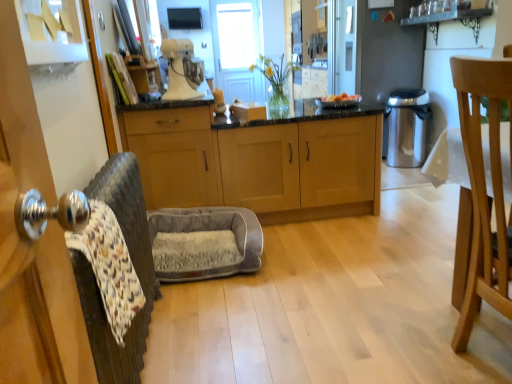
At what (x,y) coordinates should I click in order to perform the action: click on unoccupied region to the right of light brown wood cabinets at center, positioned as the 2th cabinetry in left-to-right order. Please return your answer as a coordinate pair (x, y). The width and height of the screenshot is (512, 384). Looking at the image, I should click on (412, 201).